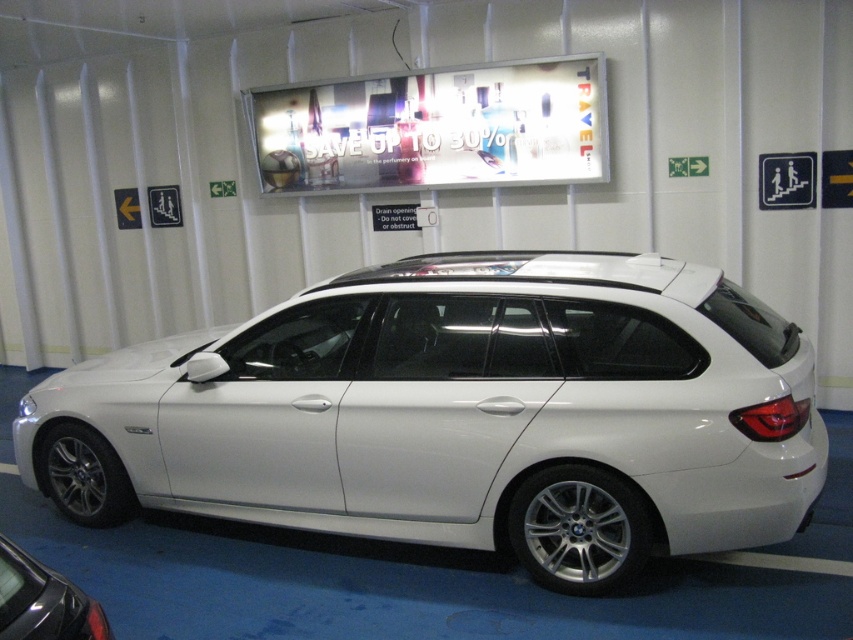
Question: Can you confirm if white metallic car at center is positioned above white metallic car at lower left?

Choices:
 (A) yes
 (B) no

Answer: (A)

Question: Is white metallic car at center to the right of white metallic car at lower left from the viewer's perspective?

Choices:
 (A) no
 (B) yes

Answer: (B)

Question: Is white metallic car at center to the right of white metallic car at lower left from the viewer's perspective?

Choices:
 (A) yes
 (B) no

Answer: (A)

Question: Which object is closer to the camera taking this photo?

Choices:
 (A) white metallic car at lower left
 (B) white metallic car at center

Answer: (A)